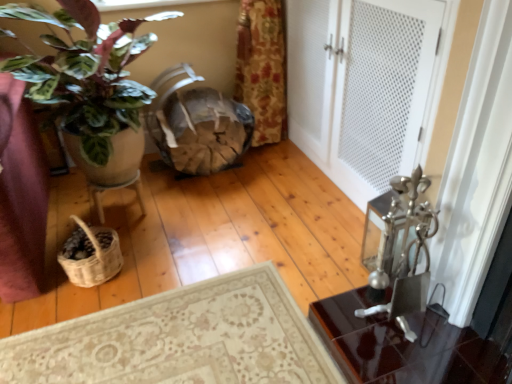
Question: Can you confirm if wooden textured basket at center is shorter than white textured door at center?

Choices:
 (A) yes
 (B) no

Answer: (A)

Question: Does wooden textured basket at center have a greater width compared to white textured door at center?

Choices:
 (A) no
 (B) yes

Answer: (A)

Question: From the image's perspective, is wooden textured basket at center located above white textured door at center?

Choices:
 (A) no
 (B) yes

Answer: (A)

Question: Does wooden textured basket at center have a lesser width compared to white textured door at center?

Choices:
 (A) yes
 (B) no

Answer: (A)

Question: Considering the relative sizes of wooden textured basket at center and white textured door at center in the image provided, is wooden textured basket at center taller than white textured door at center?

Choices:
 (A) no
 (B) yes

Answer: (A)

Question: Is white textured door at center inside the boundaries of woven natural fiber basket at lower left, or outside?

Choices:
 (A) inside
 (B) outside

Answer: (B)

Question: From the image's perspective, relative to woven natural fiber basket at lower left, is white textured door at center above or below?

Choices:
 (A) above
 (B) below

Answer: (A)

Question: In terms of width, does white textured door at center look wider or thinner when compared to woven natural fiber basket at lower left?

Choices:
 (A) wide
 (B) thin

Answer: (A)

Question: From a real-world perspective, relative to woven natural fiber basket at lower left, is white textured door at center vertically above or below?

Choices:
 (A) above
 (B) below

Answer: (A)

Question: Considering the positions of point (144, 46) and point (388, 6), is point (144, 46) closer or farther from the camera than point (388, 6)?

Choices:
 (A) closer
 (B) farther

Answer: (B)

Question: Is matte brown pot at left spatially inside white textured door at center, or outside of it?

Choices:
 (A) inside
 (B) outside

Answer: (B)

Question: From their relative heights in the image, would you say matte brown pot at left is taller or shorter than white textured door at center?

Choices:
 (A) tall
 (B) short

Answer: (B)

Question: Is matte brown pot at left wider or thinner than white textured door at center?

Choices:
 (A) wide
 (B) thin

Answer: (A)

Question: From a real-world perspective, is white textured door at center above or below wooden textured basket at center?

Choices:
 (A) above
 (B) below

Answer: (A)

Question: From the image's perspective, is white textured door at center above or below wooden textured basket at center?

Choices:
 (A) below
 (B) above

Answer: (B)